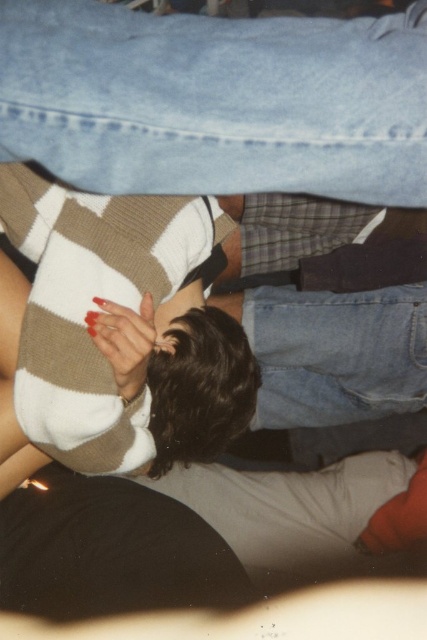
Question: Is denim jeans at upper center above shiny red nails at center?

Choices:
 (A) no
 (B) yes

Answer: (B)

Question: Is denim jeans at upper center below shiny red nails at center?

Choices:
 (A) yes
 (B) no

Answer: (B)

Question: Does denim jeans at upper center come behind shiny red nails at center?

Choices:
 (A) yes
 (B) no

Answer: (B)

Question: Which object is closer to the camera taking this photo?

Choices:
 (A) denim jeans at upper center
 (B) shiny red nails at center

Answer: (A)